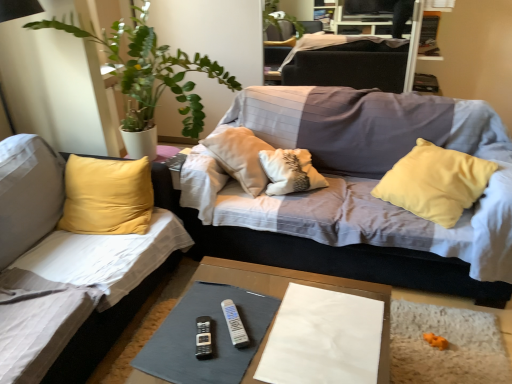
Question: Is textured gray couch at center, which is the first studio couch in right-to-left order, at the left side of white plastic remote at center, which is the 1th remote from right to left?

Choices:
 (A) yes
 (B) no

Answer: (B)

Question: From the image's perspective, is textured gray couch at center, which is the first studio couch in right-to-left order, beneath white plastic remote at center, which is the 1th remote from right to left?

Choices:
 (A) yes
 (B) no

Answer: (B)

Question: Does textured gray couch at center, which is the first studio couch in right-to-left order, have a greater height compared to white plastic remote at center, which is counted as the second remote, starting from the left?

Choices:
 (A) yes
 (B) no

Answer: (A)

Question: Does textured gray couch at center, which is the first studio couch in right-to-left order, have a greater width compared to white plastic remote at center, which is counted as the second remote, starting from the left?

Choices:
 (A) yes
 (B) no

Answer: (A)

Question: Could you tell me if textured gray couch at center, which is the first studio couch in right-to-left order, is turned towards white plastic remote at center, which is the 1th remote from right to left?

Choices:
 (A) no
 (B) yes

Answer: (B)

Question: Can you confirm if textured gray couch at center, which is the first studio couch in right-to-left order, is thinner than white plastic remote at center, which is the 1th remote from right to left?

Choices:
 (A) yes
 (B) no

Answer: (B)

Question: Is dark gray fabric couch at upper center surrounding white paper at center?

Choices:
 (A) yes
 (B) no

Answer: (B)

Question: From a real-world perspective, is dark gray fabric couch at upper center under white paper at center?

Choices:
 (A) no
 (B) yes

Answer: (A)

Question: Is dark gray fabric couch at upper center oriented away from white paper at center?

Choices:
 (A) yes
 (B) no

Answer: (B)

Question: Is dark gray fabric couch at upper center taller than white paper at center?

Choices:
 (A) yes
 (B) no

Answer: (A)

Question: Is dark gray fabric couch at upper center outside white paper at center?

Choices:
 (A) no
 (B) yes

Answer: (B)

Question: From the image's perspective, is dark gray fabric couch at upper center located above white paper at center?

Choices:
 (A) no
 (B) yes

Answer: (B)

Question: Is the position of black plastic remote at center, which is the second remote from right to left, less distant than that of white paper at center?

Choices:
 (A) yes
 (B) no

Answer: (B)